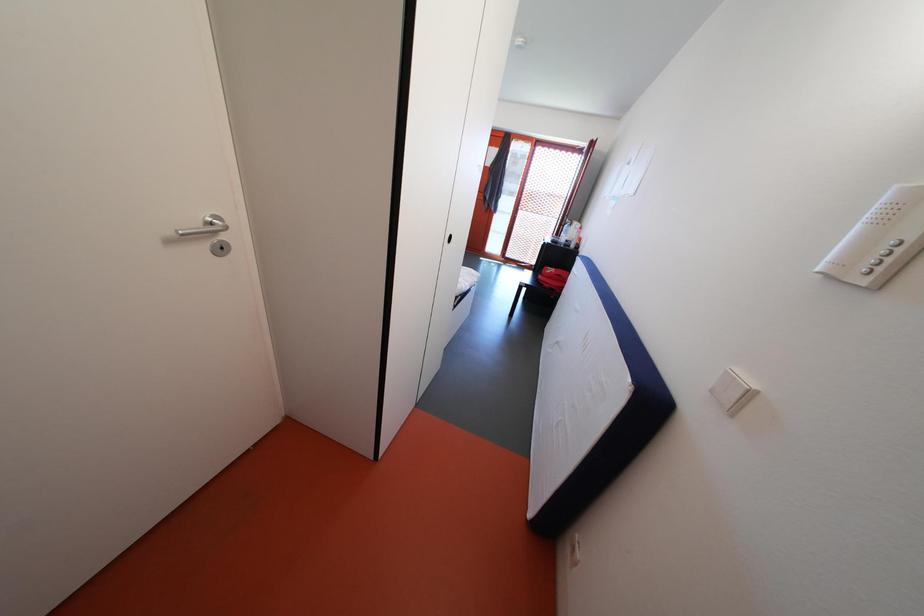
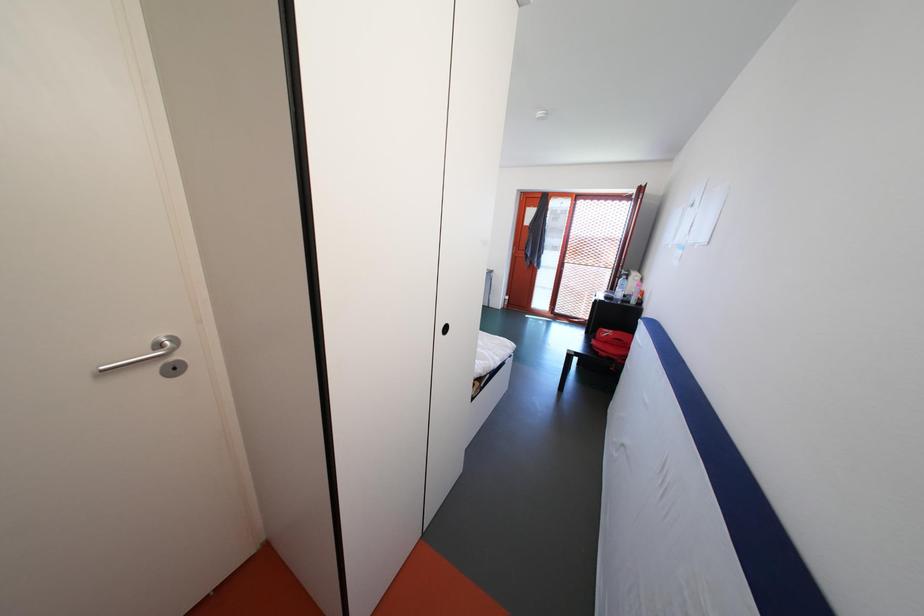
Which direction would the cameraman need to move to produce the second image?

The cameraman moved toward right, forward.